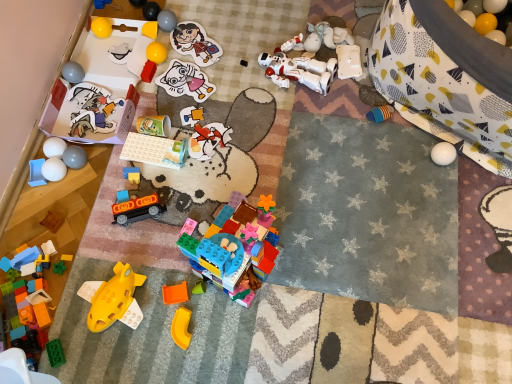
You are a GUI agent. You are given a task and a screenshot of the screen. Output one action in this format:
    pyautogui.click(x=<x>, y=<y>)
    Task: Click on the empty space that is in between yellow rubber ball at upper left, the fifteenth toy viewed from the left, and orange matte train at center, which is the twelfth toy in right-to-left order
    This screenshot has height=384, width=512.
    Given the screenshot: What is the action you would take?
    pyautogui.click(x=146, y=154)